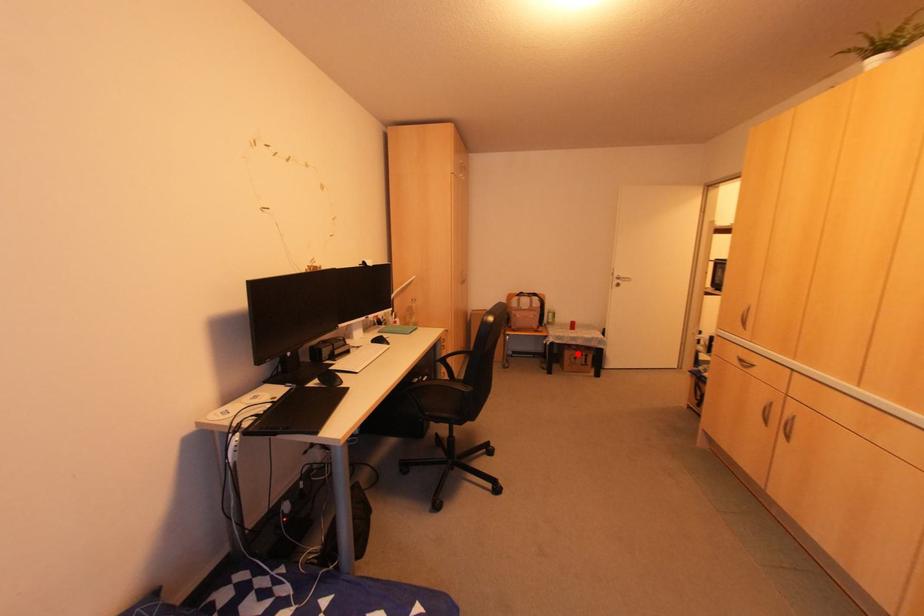
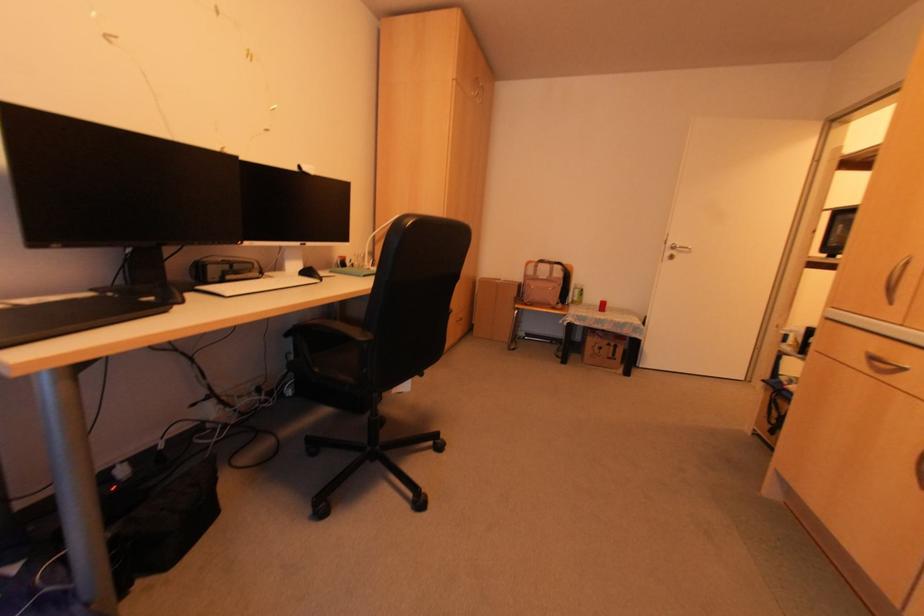
Find the pixel in the second image that matches the highlighted location in the first image.

(604, 342)